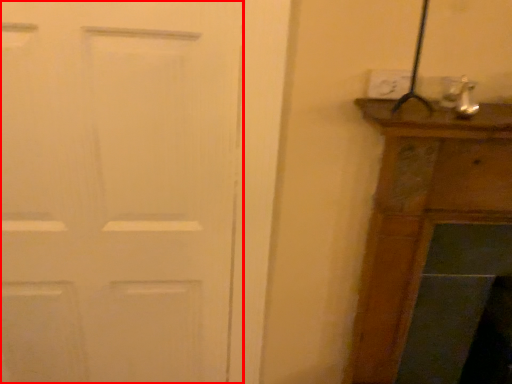
Question: From the image's perspective, what is the correct spatial relationship of door (annotated by the red box) in relation to electric outlet?

Choices:
 (A) above
 (B) below

Answer: (B)